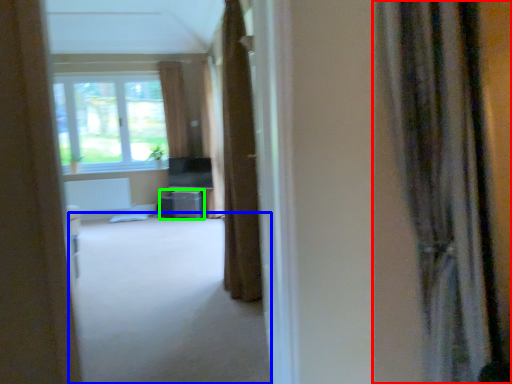
Question: Estimate the real-world distances between objects in this image. Which object is farther from curtain (highlighted by a red box), corridor (highlighted by a blue box) or furniture (highlighted by a green box)?

Choices:
 (A) corridor
 (B) furniture

Answer: (B)